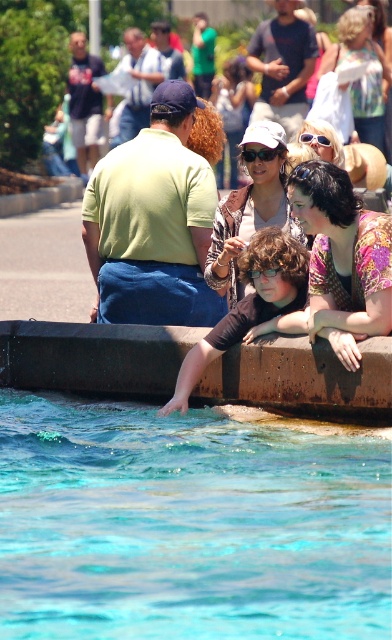
Question: Can you confirm if matte white sunglasses at upper center is bigger than clear plastic goggles at center?

Choices:
 (A) no
 (B) yes

Answer: (B)

Question: Which point is closer to the camera?

Choices:
 (A) (379, 132)
 (B) (177, 285)

Answer: (B)

Question: Can you confirm if rustic concrete ledge at lower center is thinner than dark brown hair at center?

Choices:
 (A) no
 (B) yes

Answer: (A)

Question: Which of the following is the farthest from the observer?

Choices:
 (A) floral print shirt at center
 (B) light green shirt at center

Answer: (B)

Question: Among these points, which one is nearest to the camera?

Choices:
 (A) (326, 202)
 (B) (165, 68)
 (C) (94, 164)
 (D) (94, 246)

Answer: (A)

Question: Is rustic concrete ledge at lower center bigger than green matte shirt at upper left?

Choices:
 (A) yes
 (B) no

Answer: (B)